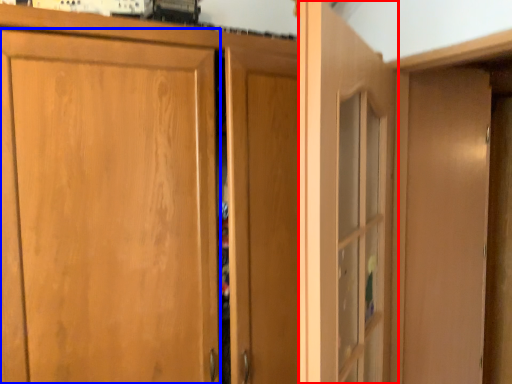
Question: Which point is closer to the camera, door (highlighted by a red box) or door (highlighted by a blue box)?

Choices:
 (A) door
 (B) door

Answer: (A)